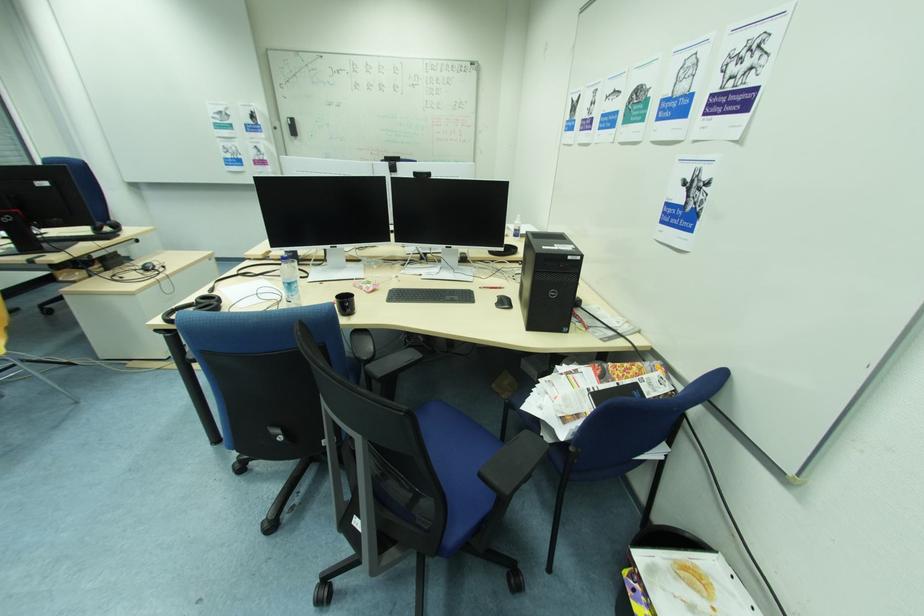
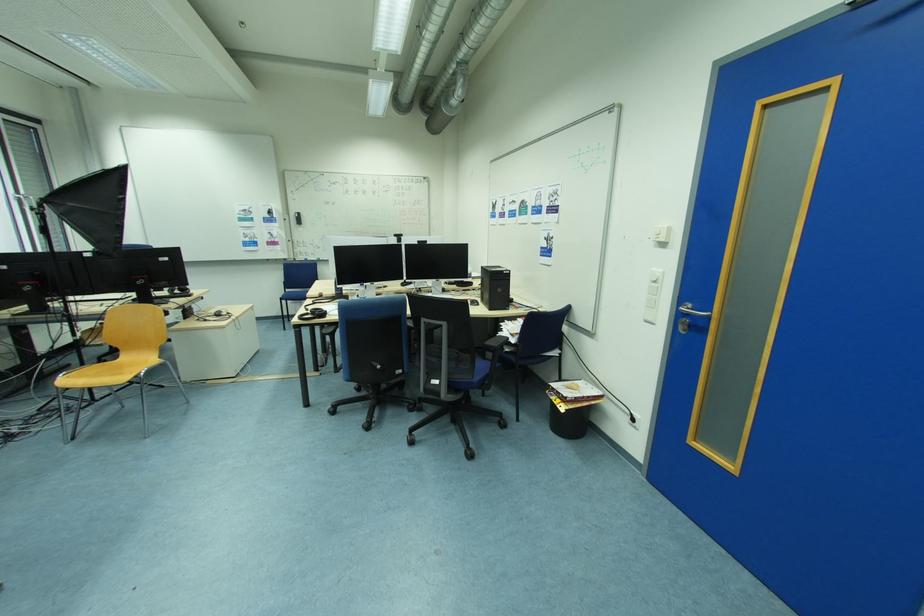
Find the pixel in the second image that matches point (217, 292) in the first image.

(313, 310)